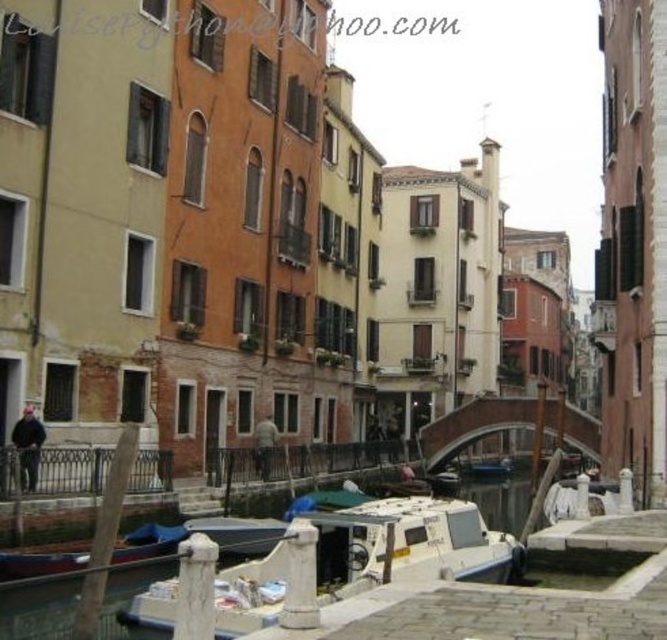
You are a tourist standing on the bridge and want to take a photo of both the white matte boat at center and the white plastic boat at center. Which boat should you focus on first if you want to include both in your frame?

You should focus on the white plastic boat at center first because the white matte boat at center is positioned over it, so adjusting the camera angle to include the lower boat first ensures both are in the frame.

You are a tourist standing on the bridge over the canal. You see two boats at the center of the canal below you. Which boat is taller, the white matte boat at center or the white plastic boat at center?

The white matte boat at center is much taller than the white plastic boat at center.

You are standing on the pedestrian bridge in the background of the canal scene. You see a point marked at coordinates (410, 544). What object is located at this point?

The point at coordinates (410, 544) indicates the white matte boat at center.